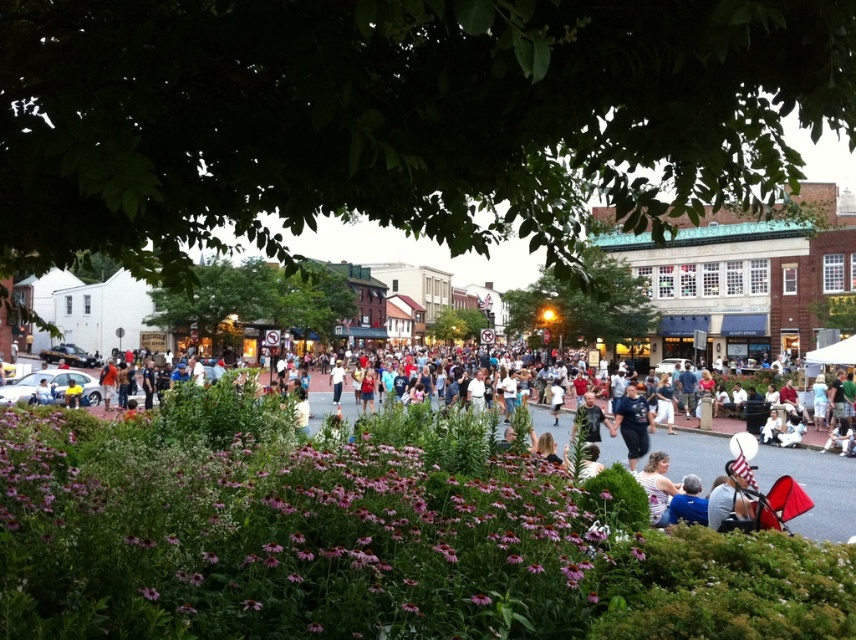
Between purple matte flowers at center and light brown hair at lower center, which one appears on the right side from the viewer's perspective?

From the viewer's perspective, light brown hair at lower center appears more on the right side.

Which of these two, purple matte flowers at center or light brown hair at lower center, stands shorter?

light brown hair at lower center

Image resolution: width=856 pixels, height=640 pixels. I want to click on purple matte flowers at center, so click(x=286, y=540).

Is light brown hair at lower center to the left of blue fabric at lower right from the viewer's perspective?

Correct, you'll find light brown hair at lower center to the left of blue fabric at lower right.

Can you confirm if light brown hair at lower center is smaller than blue fabric at lower right?

No.

Identify the location of light brown hair at lower center. (657, 486).

Is purple matte flowers at center smaller than dark blue jeans at center?

Incorrect, purple matte flowers at center is not smaller in size than dark blue jeans at center.

From the picture: Measure the distance from purple matte flowers at center to dark blue jeans at center.

purple matte flowers at center is 38.58 meters from dark blue jeans at center.

Is point (149, 506) less distant than point (628, 442)?

Yes, it is.

What are the coordinates of `purple matte flowers at center` in the screenshot? It's located at (286, 540).